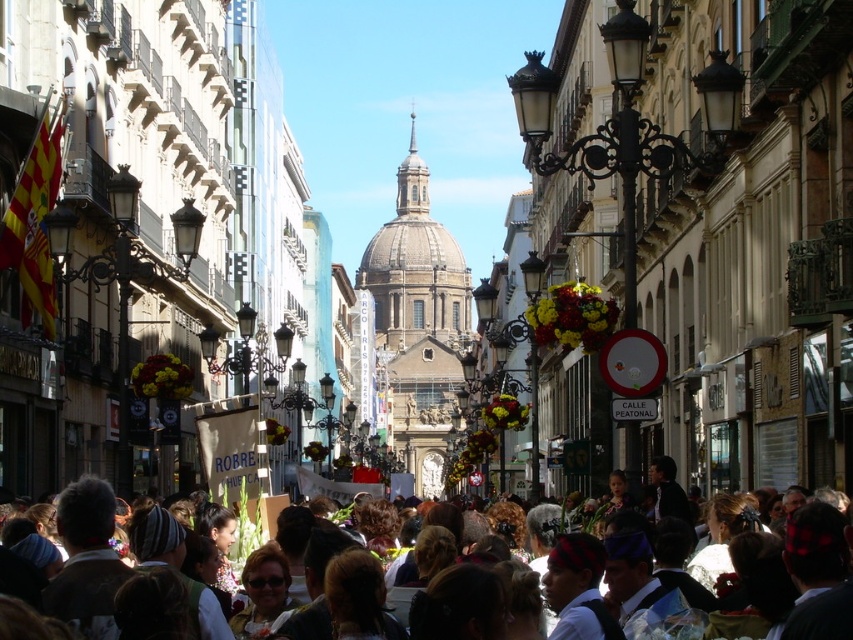
You are a tourist standing on the street and see the smooth stone dome at center and the brown hair at center. Which object is positioned to the left?

The smooth stone dome at center is to the left of brown hair at center.

You are a photographer standing in the middle of the street, and you want to capture both the smooth stone dome at center and the brown hair at center in a single photo. Which object will appear taller in your photo?

The smooth stone dome at center will appear taller in the photo because it has a greater height compared to the brown hair at center.

You are a tourist standing on the street in front of the grand domed building. You want to take a photo that includes both the smooth stone dome at center and the decorative street lamps on the sides. Given that your camera can capture a maximum distance of 200 meters, will you be able to include both in the same frame?

The smooth stone dome at center is 237.34 meters away from the viewer. Since the camera can only capture up to 200 meters, the distance exceeds the camera range. Therefore, the smooth stone dome at center cannot be included in the photo along with the decorative street lamps on the sides.